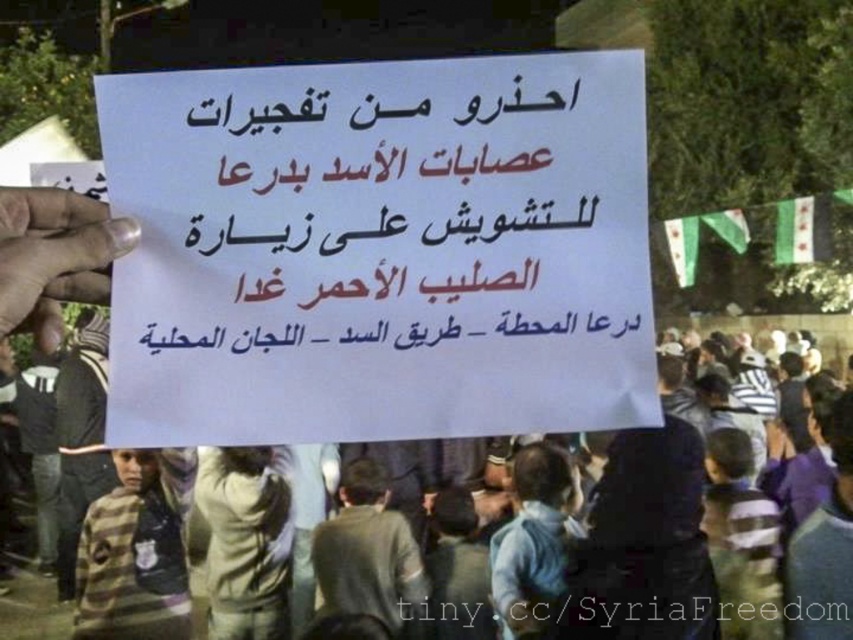
Question: Which of the following is the farthest from the observer?

Choices:
 (A) (71, 572)
 (B) (311, 200)

Answer: (A)

Question: Which of the following is the farthest from the observer?

Choices:
 (A) dark gray jacket at left
 (B) gray woolen sweater at center
 (C) white paper sign at center

Answer: (A)

Question: Is gray woolen sweater at center above dark gray jacket at left?

Choices:
 (A) no
 (B) yes

Answer: (A)

Question: Is gray woolen sweater at center in front of dark gray jacket at left?

Choices:
 (A) no
 (B) yes

Answer: (B)

Question: Which of the following is the closest to the observer?

Choices:
 (A) white paper sign at center
 (B) dark gray jacket at left

Answer: (A)

Question: Does white paper sign at center lie in front of dark gray jacket at left?

Choices:
 (A) no
 (B) yes

Answer: (B)